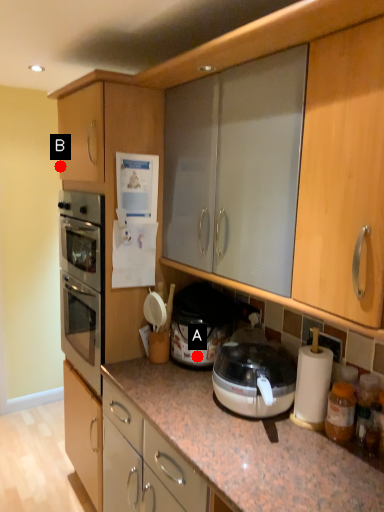
Question: Two points are circled on the image, labeled by A and B beside each circle. Among these points, which one is farthest from the camera?

Choices:
 (A) A is further
 (B) B is further

Answer: (B)